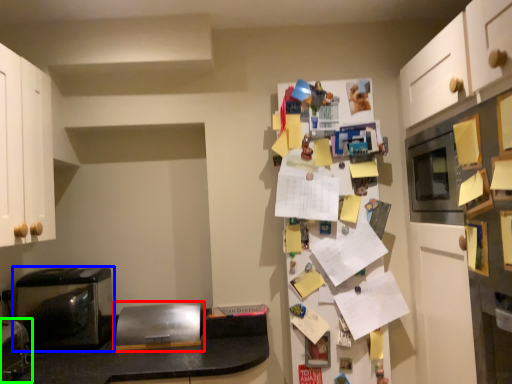
Question: Considering the real-world distances, which object is closest to appliance (highlighted by a red box)? home appliance (highlighted by a blue box) or appliance (highlighted by a green box).

Choices:
 (A) home appliance
 (B) appliance

Answer: (A)